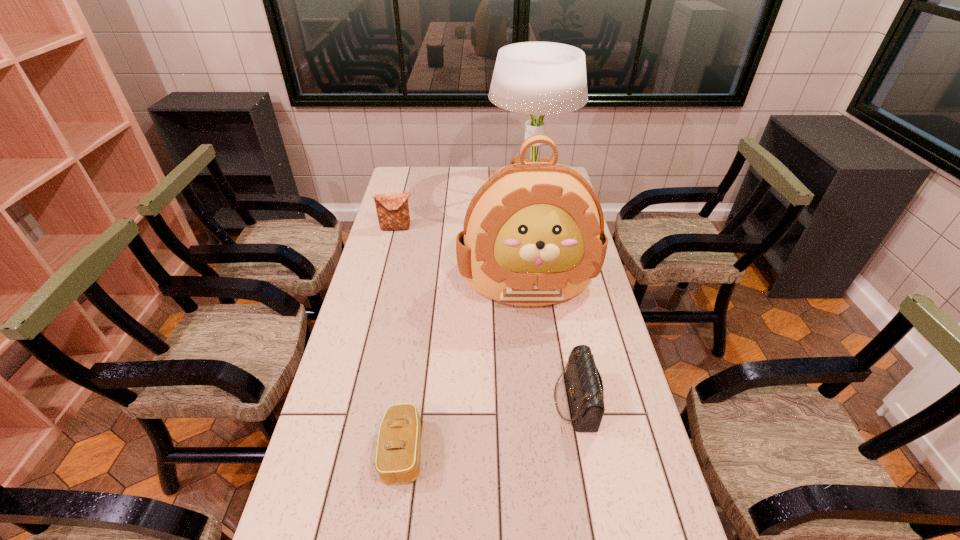
Where is `backpack that is at the right edge`? The height and width of the screenshot is (540, 960). backpack that is at the right edge is located at coordinates (533, 235).

Locate an element on the screen. clutch bag that is at the right edge is located at coordinates (585, 386).

Where is `object that is at the far right corner`? Image resolution: width=960 pixels, height=540 pixels. object that is at the far right corner is located at coordinates (536, 78).

At what (x,y) coordinates should I click in order to perform the action: click on vacant space at the left edge of the desktop. Please return your answer as a coordinate pair (x, y). Looking at the image, I should click on (309, 481).

Locate an element on the screen. The height and width of the screenshot is (540, 960). vacant region at the right edge of the desktop is located at coordinates (582, 448).

At what (x,y) coordinates should I click in order to perform the action: click on free space at the far left corner of the desktop. Please return your answer as a coordinate pair (x, y). Looking at the image, I should click on (407, 176).

Where is `vacant space in between the farthest object and the fourth object from right to left`? The image size is (960, 540). vacant space in between the farthest object and the fourth object from right to left is located at coordinates (467, 322).

Where is `free space between the tallest clutch bag and the second clutch bag from right to left`? free space between the tallest clutch bag and the second clutch bag from right to left is located at coordinates (399, 340).

Where is `unoccupied area between the second object from left to right and the backpack`? This screenshot has width=960, height=540. unoccupied area between the second object from left to right and the backpack is located at coordinates (465, 367).

I want to click on vacant space that's between the third shortest object and the second clutch bag from left to right, so coord(399,340).